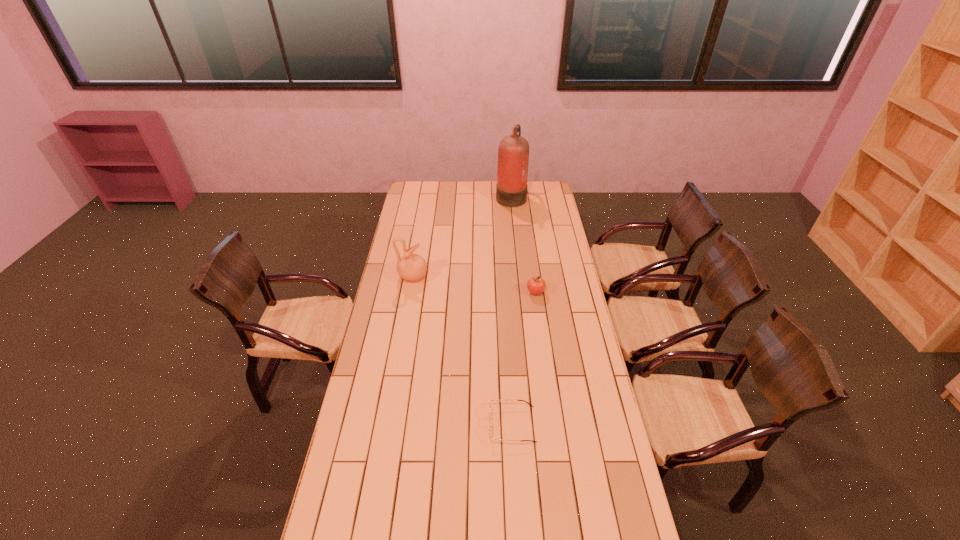
Locate an element on the screen. This screenshot has height=540, width=960. vacant space at the right edge of the desktop is located at coordinates (599, 408).

Where is `vacant space at the far right corner of the desktop`? vacant space at the far right corner of the desktop is located at coordinates (541, 197).

Locate an element on the screen. The image size is (960, 540). empty space that is in between the apple and the third shortest object is located at coordinates (474, 285).

At what (x,y) coordinates should I click in order to perform the action: click on vacant space in between the shortest object and the fire extinguisher. Please return your answer as a coordinate pair (x, y). Looking at the image, I should click on pos(512,310).

What are the coordinates of `vacant space that is in between the farthest object and the pottery` in the screenshot? It's located at (462, 237).

What are the coordinates of `free space between the second tallest object and the fire extinguisher` in the screenshot? It's located at (462, 237).

Find the location of `free space that is in between the apple and the nearest object`. free space that is in between the apple and the nearest object is located at coordinates (524, 358).

I want to click on free space between the fire extinguisher and the apple, so click(x=523, y=244).

The width and height of the screenshot is (960, 540). What are the coordinates of `empty space between the shortest object and the pottery` in the screenshot? It's located at (463, 350).

Locate an element on the screen. The width and height of the screenshot is (960, 540). vacant region between the tallest object and the second tallest object is located at coordinates pyautogui.click(x=462, y=237).